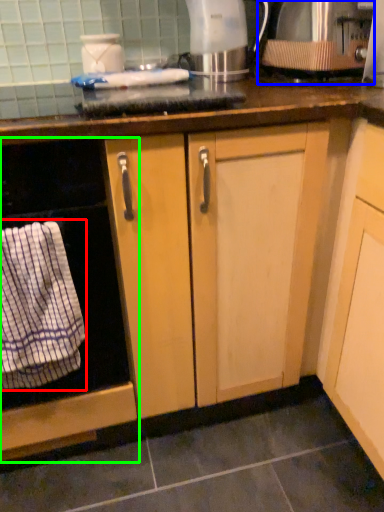
Question: Considering the real-world distances, which object is closest to bath towel (highlighted by a red box)? kitchen appliance (highlighted by a blue box) or home appliance (highlighted by a green box).

Choices:
 (A) kitchen appliance
 (B) home appliance

Answer: (B)